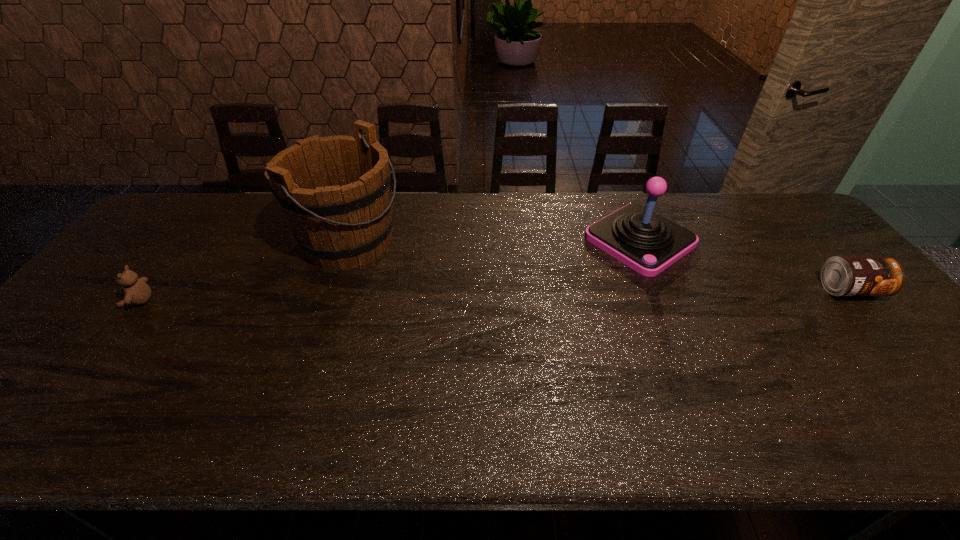
What are the coordinates of `the leftmost object` in the screenshot? It's located at (137, 292).

The height and width of the screenshot is (540, 960). I want to click on the rightmost object, so click(840, 275).

You are a GUI agent. You are given a task and a screenshot of the screen. Output one action in this format:
    pyautogui.click(x=<x>, y=<y>)
    Task: Click on the joystick
    
    Given the screenshot: What is the action you would take?
    pyautogui.click(x=648, y=243)

This screenshot has width=960, height=540. Find the location of `the second tallest object`. the second tallest object is located at coordinates (648, 243).

The width and height of the screenshot is (960, 540). Find the location of `the tallest object`. the tallest object is located at coordinates (334, 191).

Locate an element on the screen. This screenshot has height=540, width=960. wine bucket is located at coordinates (334, 191).

At what (x,y) coordinates should I click in order to perform the action: click on vacant space located 0.050m on the front-facing side of the teddy bear. Please return your answer as a coordinate pair (x, y). The height and width of the screenshot is (540, 960). Looking at the image, I should click on (106, 301).

Locate an element on the screen. Image resolution: width=960 pixels, height=540 pixels. blank space located 0.180m on the front label of the can is located at coordinates (911, 360).

The width and height of the screenshot is (960, 540). Find the location of `free location located forward from the base of the joystick`. free location located forward from the base of the joystick is located at coordinates (538, 305).

You are a GUI agent. You are given a task and a screenshot of the screen. Output one action in this format:
    pyautogui.click(x=<x>, y=<y>)
    Task: Click on the free spot located 0.300m forward from the base of the joystick
    The width and height of the screenshot is (960, 540).
    Given the screenshot: What is the action you would take?
    pyautogui.click(x=530, y=310)